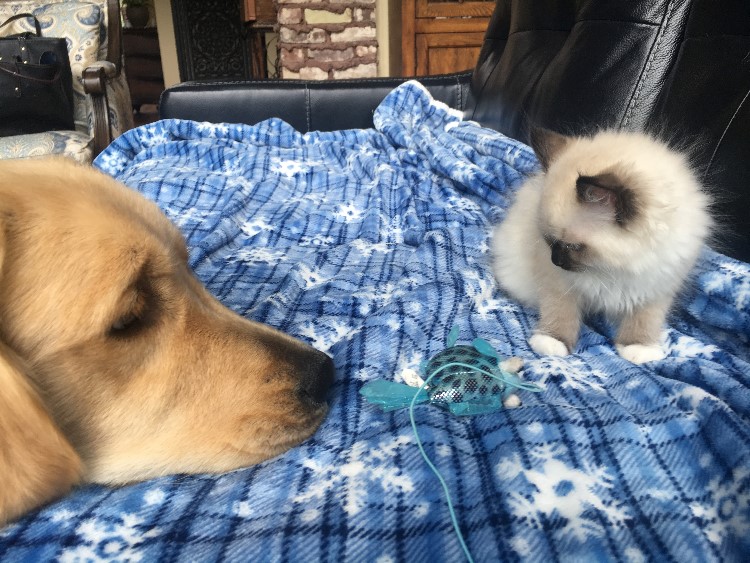
Image resolution: width=750 pixels, height=563 pixels. I want to click on couch, so click(595, 64).